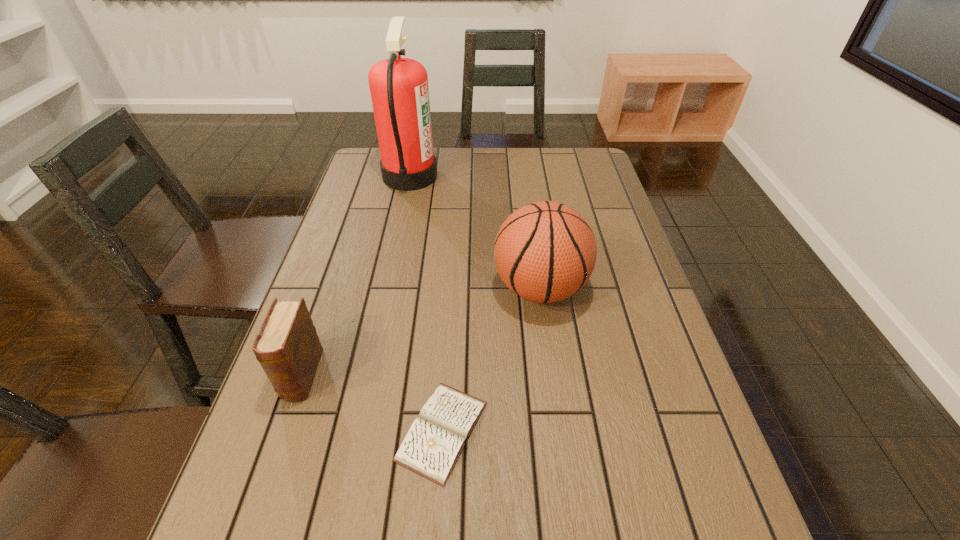
Identify the location of vacant space at the left edge of the desktop. (357, 242).

Find the location of a particular element. Image resolution: width=960 pixels, height=540 pixels. vacant space at the right edge of the desktop is located at coordinates (682, 403).

The width and height of the screenshot is (960, 540). Identify the location of vacant space at the far left corner. [377, 150].

The image size is (960, 540). In the image, there is a desktop. Find the location of `vacant space at the far right corner`. vacant space at the far right corner is located at coordinates (604, 173).

Find the location of a particular element. vacant area between the basketball and the fire extinguisher is located at coordinates (475, 232).

Find the location of a particular element. The height and width of the screenshot is (540, 960). blank region between the shorter diary and the taller diary is located at coordinates (372, 403).

Locate an element on the screen. This screenshot has width=960, height=540. unoccupied position between the leftmost object and the right diary is located at coordinates (372, 403).

The width and height of the screenshot is (960, 540). I want to click on vacant space that's between the second farthest object and the shortest object, so click(491, 360).

Identify the location of vacant space that's between the shortest object and the farthest object. The width and height of the screenshot is (960, 540). (426, 303).

This screenshot has height=540, width=960. What are the coordinates of `free area in between the fire extinguisher and the shortest object` in the screenshot? It's located at (426, 303).